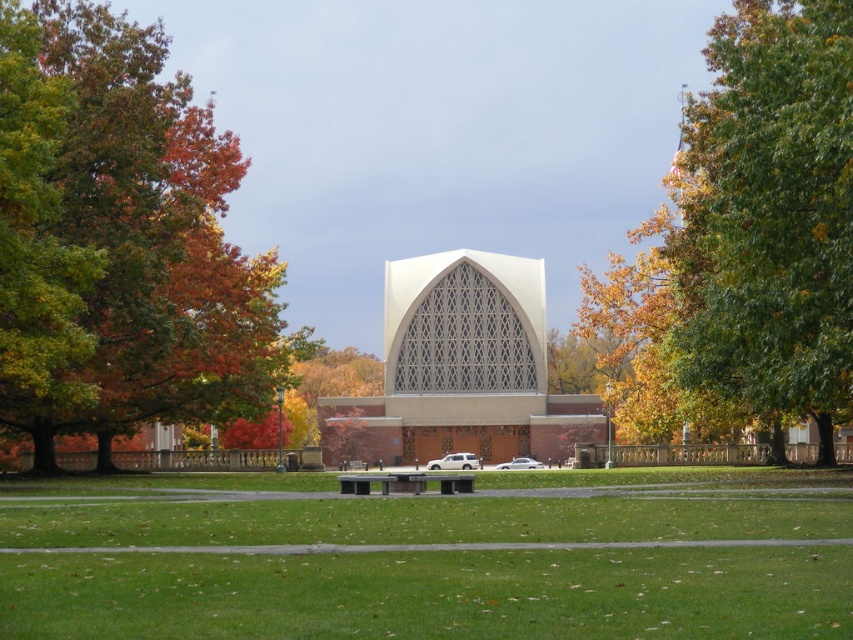
Does wooden park bench at center have a greater width compared to white matte suv at center?

No.

Can you confirm if wooden park bench at center is positioned to the left of white matte suv at center?

Incorrect, wooden park bench at center is not on the left side of white matte suv at center.

Does point (439, 481) come farther from viewer compared to point (447, 464)?

No, (439, 481) is closer to viewer.

Where is `wooden park bench at center`? The height and width of the screenshot is (640, 853). wooden park bench at center is located at coordinates (444, 483).

Is point (25, 333) behind point (422, 483)?

No, (25, 333) is in front of (422, 483).

Image resolution: width=853 pixels, height=640 pixels. What are the coordinates of `autumn leaves at left` in the screenshot? It's located at (120, 241).

This screenshot has height=640, width=853. Describe the element at coordinates (120, 241) in the screenshot. I see `autumn leaves at left` at that location.

Identify the location of autumn leaves at left. This screenshot has height=640, width=853. (120, 241).

Between green grass at center and metallic gray park bench at center, which one is positioned higher?

metallic gray park bench at center is above.

Does green grass at center appear on the right side of metallic gray park bench at center?

Yes, green grass at center is to the right of metallic gray park bench at center.

Who is more forward, [320,515] or [404,481]?

Point [320,515]

Identify the location of green grass at center. The height and width of the screenshot is (640, 853). (431, 557).